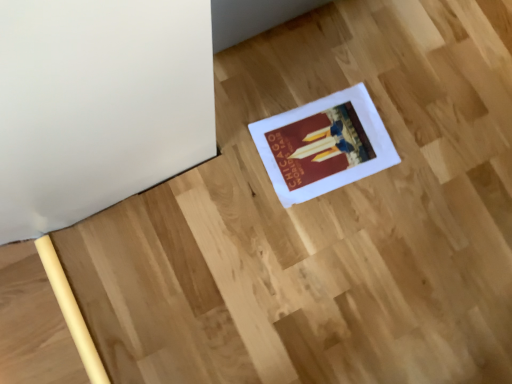
At what (x,y) coordinates should I click in order to perform the action: click on vacant area that is in front of white matte picture frame at center. Please return your answer as a coordinate pair (x, y). This screenshot has height=384, width=512. Looking at the image, I should click on (294, 239).